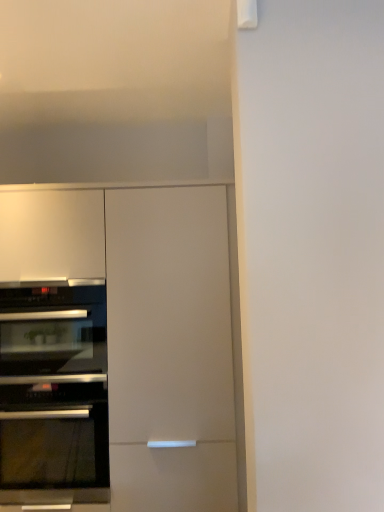
Question: Is black glass oven at left, which appears as the second oven when viewed from the top, wider or thinner than black glass oven at left, positioned as the second oven in bottom-to-top order?

Choices:
 (A) wide
 (B) thin

Answer: (A)

Question: In terms of height, does black glass oven at left, placed as the first oven when sorted from bottom to top, look taller or shorter compared to black glass oven at left, the first oven from the top?

Choices:
 (A) tall
 (B) short

Answer: (A)

Question: Which of these objects is positioned closest to the black glass oven at left, the first oven from the top?

Choices:
 (A) black glass oven at left, which appears as the second oven when viewed from the top
 (B) matte white cabinet at left

Answer: (A)

Question: Which is farther from the matte white cabinet at left?

Choices:
 (A) black glass oven at left, which appears as the second oven when viewed from the top
 (B) black glass oven at left, the first oven from the top

Answer: (B)